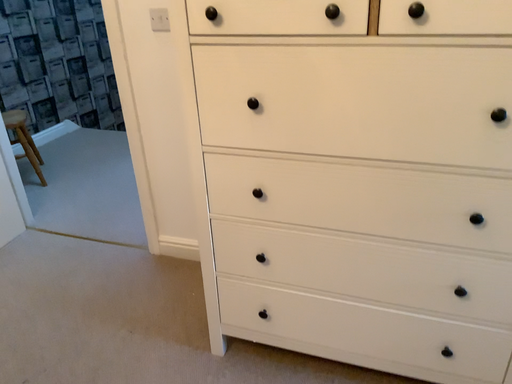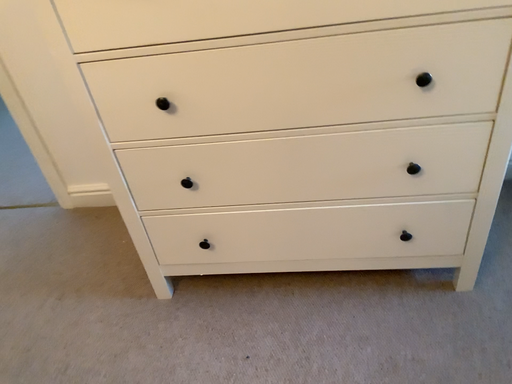
Question: Which way did the camera rotate in the video?

Choices:
 (A) rotated upward
 (B) rotated downward

Answer: (B)